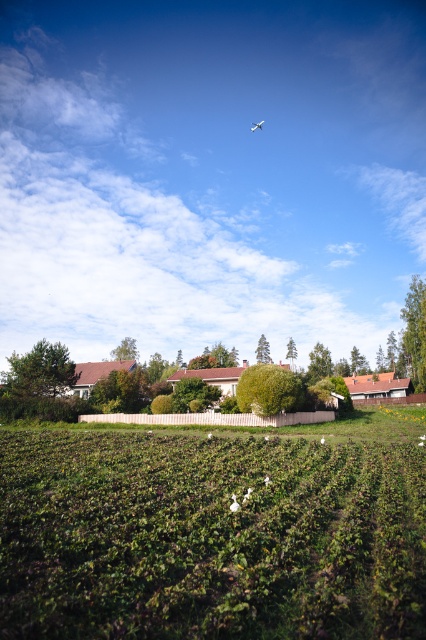
Question: Is green leafy field at center wider than green leafy hedge at center?

Choices:
 (A) no
 (B) yes

Answer: (B)

Question: Can you confirm if green leafy field at center is thinner than green leafy hedge at center?

Choices:
 (A) no
 (B) yes

Answer: (A)

Question: Which point is farther from the camera taking this photo?

Choices:
 (A) pos(417,602)
 (B) pos(256,380)

Answer: (B)

Question: Based on their relative distances, which object is farther from the white matte airplane at upper center?

Choices:
 (A) green leafy field at center
 (B) green leafy hedge at center

Answer: (A)

Question: Which point appears closest to the camera in this image?

Choices:
 (A) (256, 129)
 (B) (278, 371)
 (C) (97, 515)

Answer: (C)

Question: Does green leafy hedge at center appear over white matte airplane at upper center?

Choices:
 (A) no
 (B) yes

Answer: (A)